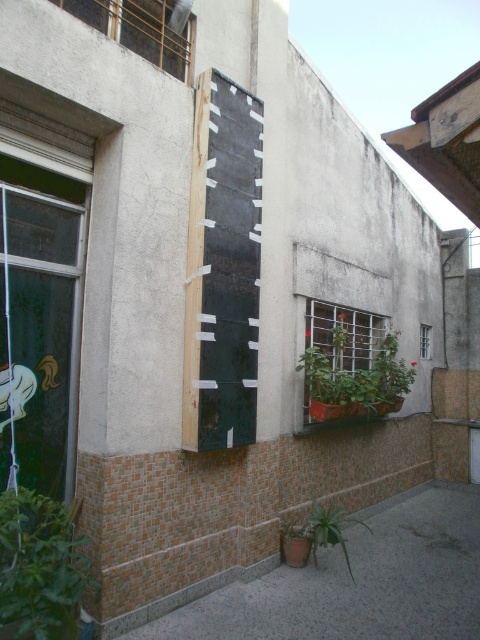
Question: Based on their relative distances, which object is nearer to the brown textured wall at lower right?

Choices:
 (A) dark green wood at center
 (B) green matte plant at lower center
 (C) green matte planter at center

Answer: (B)

Question: Among these objects, which one is nearest to the camera?

Choices:
 (A) brown textured wall at lower right
 (B) green matte plant at lower center

Answer: (A)

Question: Does brown textured wall at lower right appear on the left side of green matte planter at center?

Choices:
 (A) yes
 (B) no

Answer: (A)

Question: In this image, where is brown textured wall at lower right located relative to green plastic window box at lower center?

Choices:
 (A) right
 (B) left

Answer: (B)

Question: Based on their relative distances, which object is nearer to the green matte planter at center?

Choices:
 (A) brown textured wall at lower right
 (B) green leafy plant at lower left

Answer: (A)

Question: Observing the image, what is the correct spatial positioning of brown textured wall at lower right in reference to green plastic window box at lower center?

Choices:
 (A) left
 (B) right

Answer: (A)